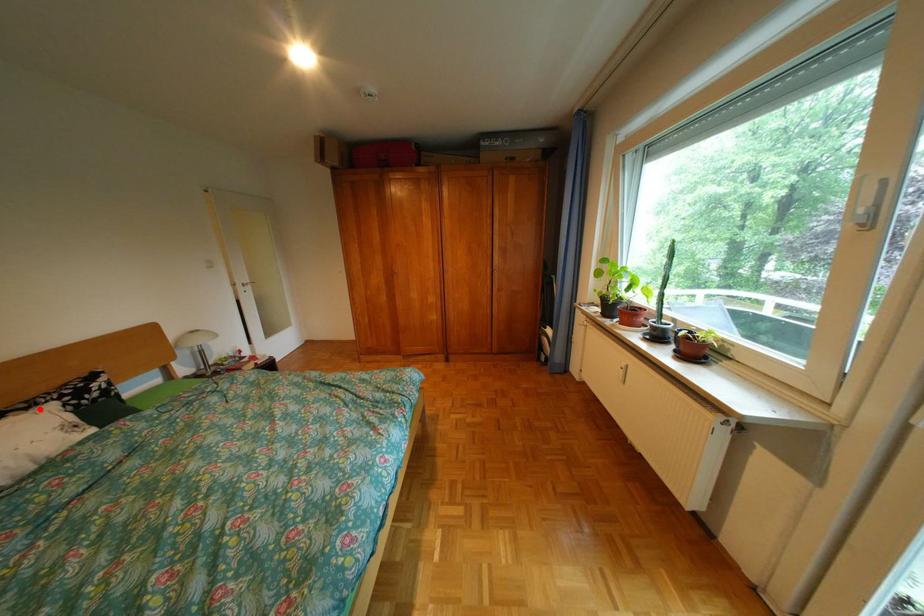
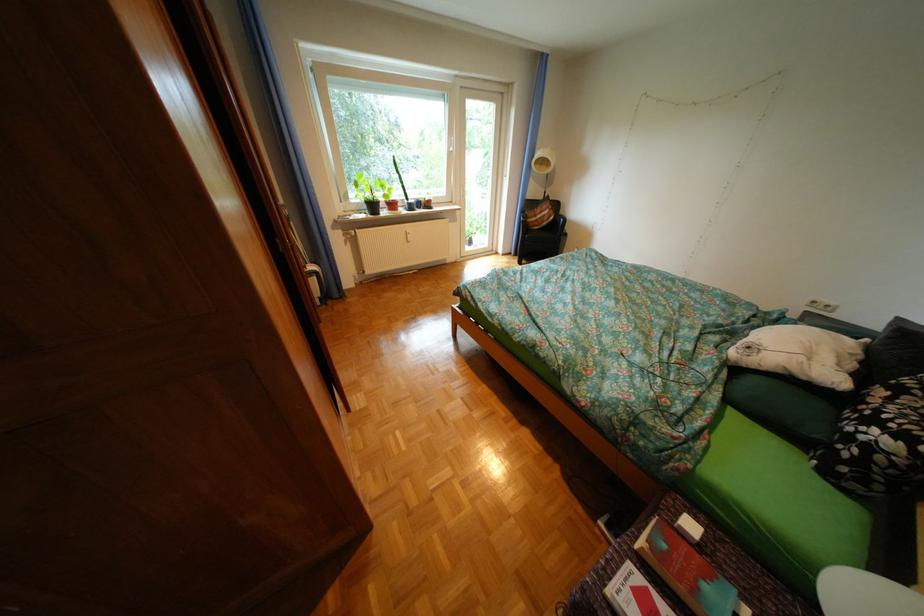
Question: I am providing you with two images of the same scene from different viewpoints. Given a red point in image1, look at the same physical point in image2. Is it:

Choices:
 (A) Closer to the viewpoint
 (B) Farther from the viewpoint

Answer: (A)